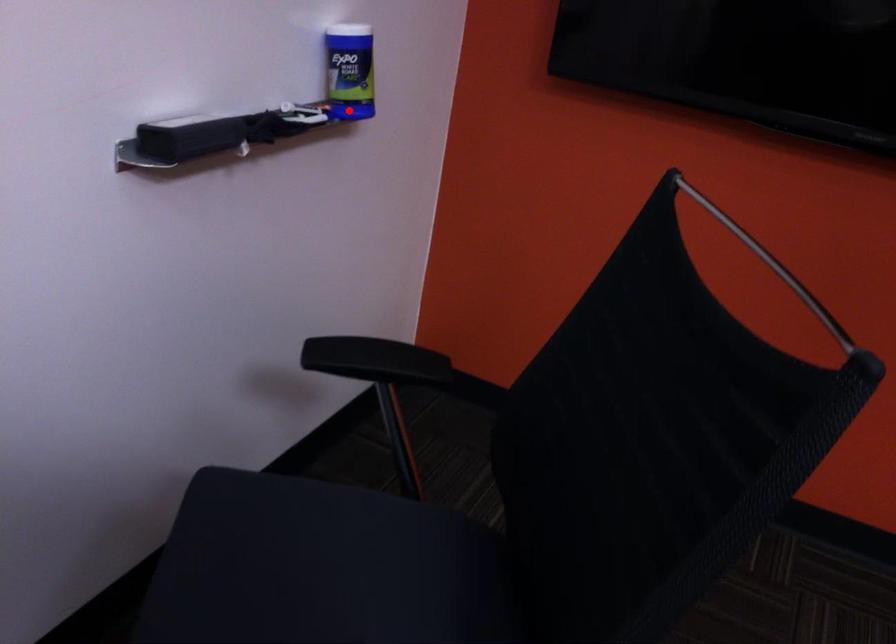
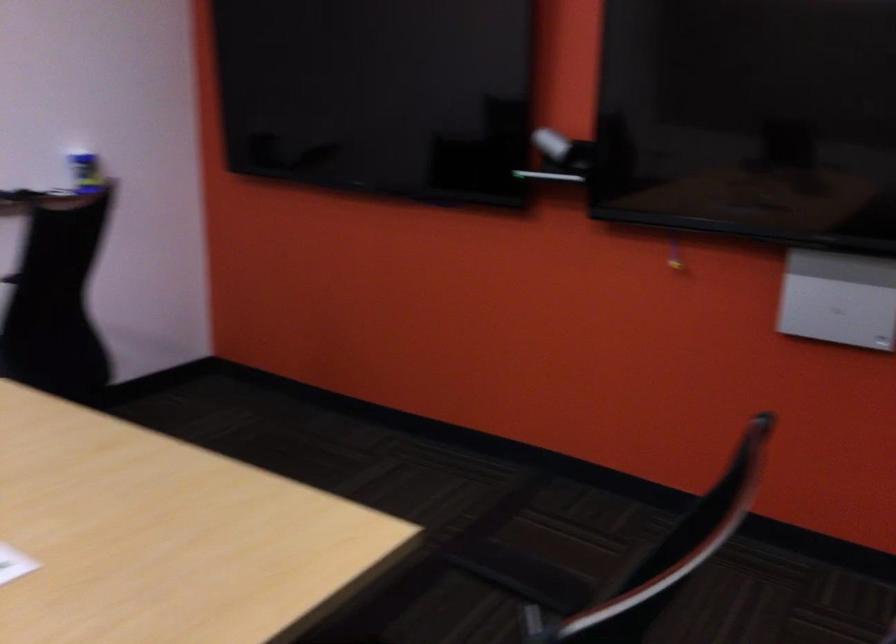
Locate, in the second image, the point that corresponds to the highlighted location in the first image.

(85, 172)